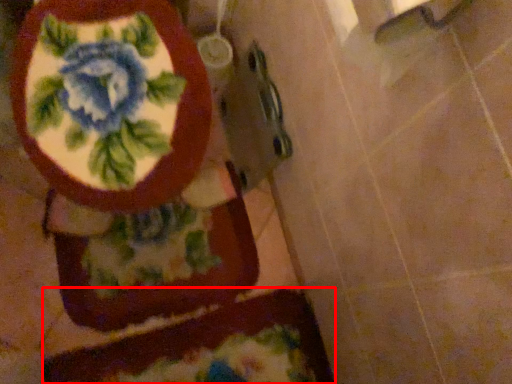
Question: From the image's perspective, considering the relative positions of bath mat (annotated by the red box) and toilet in the image provided, where is bath mat (annotated by the red box) located with respect to the staircase?

Choices:
 (A) above
 (B) below

Answer: (B)